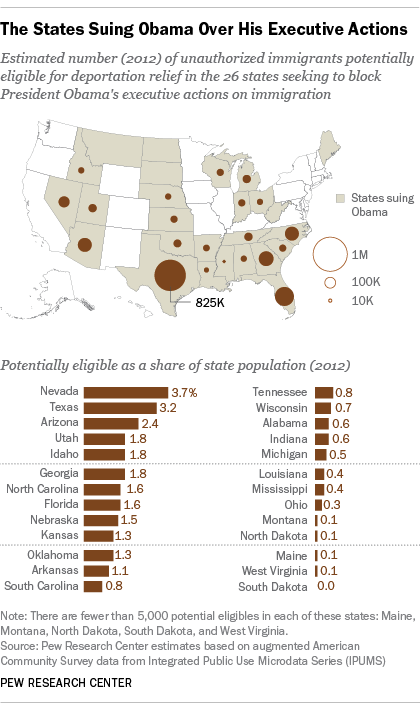
The image size is (420, 709). In order to click on map in this screenshot , I will do `click(158, 213)`.